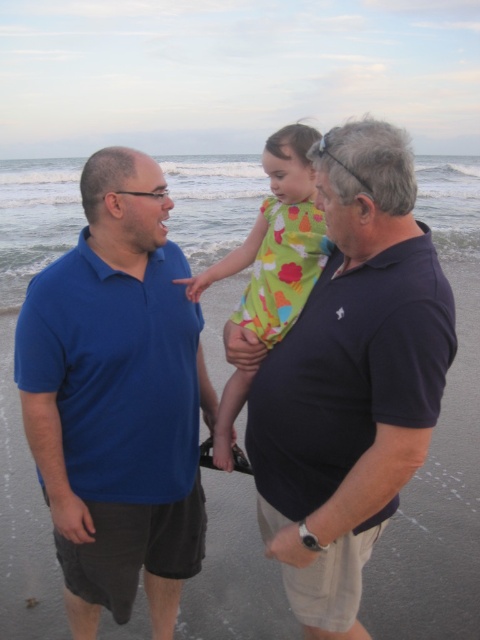
This screenshot has width=480, height=640. I want to click on matte blue polo shirt at left, so click(118, 400).

Is matte blue polo shirt at left below dark blue cotton shirt at center?

Indeed, matte blue polo shirt at left is positioned under dark blue cotton shirt at center.

Measure the distance between point (x=178, y=532) and camera.

The distance of point (x=178, y=532) from camera is 2.52 meters.

In order to click on matte blue polo shirt at left in this screenshot , I will do coord(118,400).

Is matte blue polo shirt at left above green floral dress at center?

No, matte blue polo shirt at left is not above green floral dress at center.

Locate an element on the screen. The image size is (480, 640). matte blue polo shirt at left is located at coordinates (118, 400).

Does point (115, 428) come behind point (303, 296)?

No.

This screenshot has width=480, height=640. Find the location of `matte blue polo shirt at left`. matte blue polo shirt at left is located at coordinates click(x=118, y=400).

Is dark blue cotton shirt at center below green floral dress at center?

Indeed, dark blue cotton shirt at center is positioned under green floral dress at center.

Is point (330, 608) positioned before point (261, 282)?

Yes, point (330, 608) is closer to viewer.

Between point (283, 458) and point (295, 180), which one is positioned in front?

Point (283, 458) is more forward.

Find the location of a particular element. dark blue cotton shirt at center is located at coordinates (350, 378).